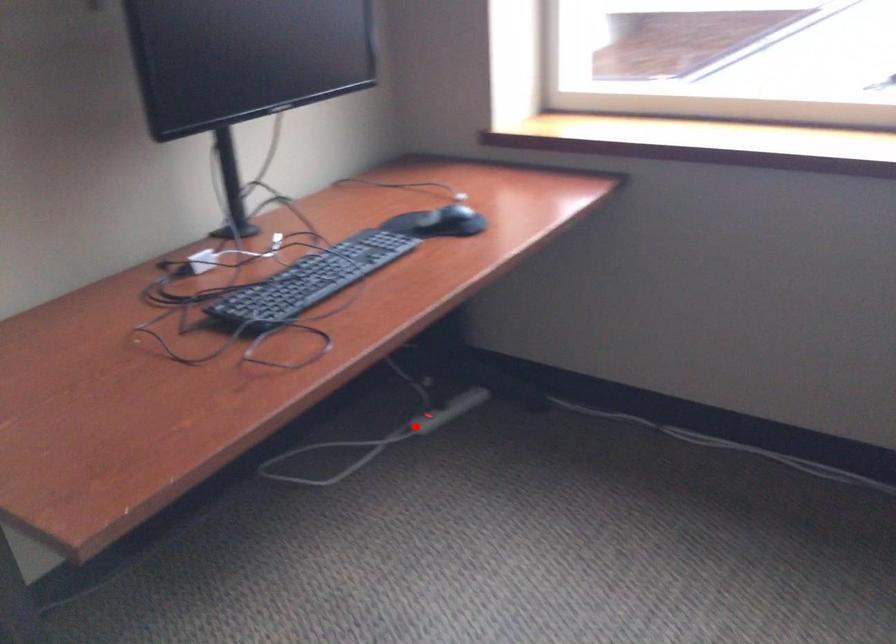
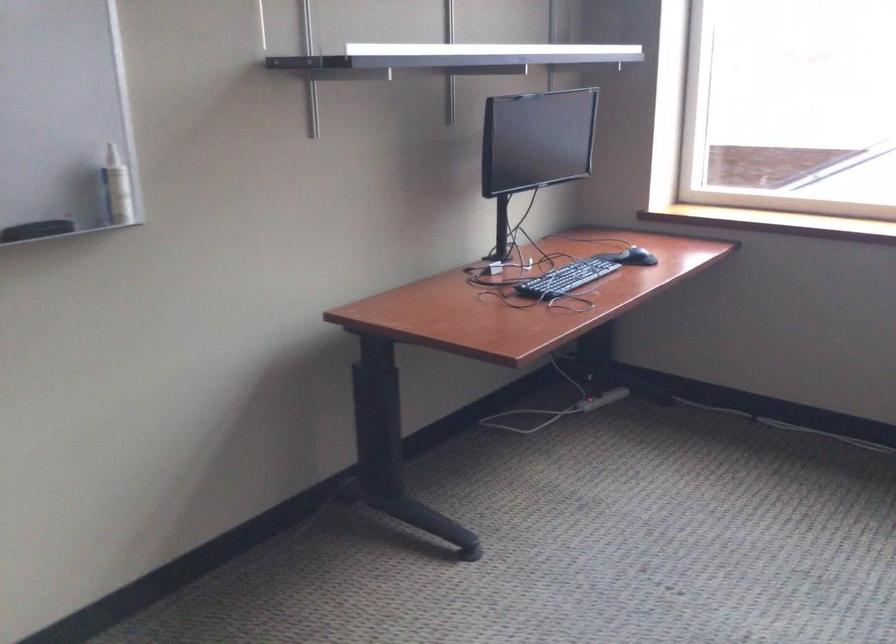
Question: I am providing you with two images of the same scene from different viewpoints. In image1, a red point is highlighted. Considering the same 3D point in image2, which of the following is correct?

Choices:
 (A) It is closer
 (B) It is farther

Answer: (B)